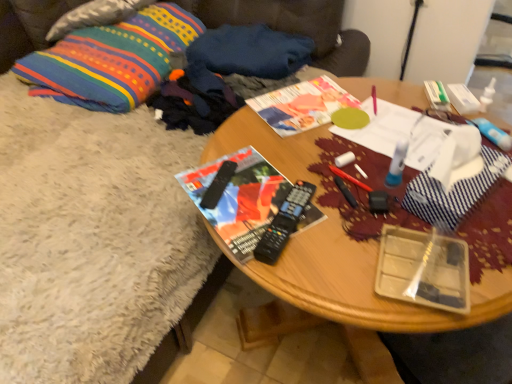
Locate an element on the screen. This screenshot has width=512, height=384. unoccupied space behind matte black magazine at center is located at coordinates (259, 145).